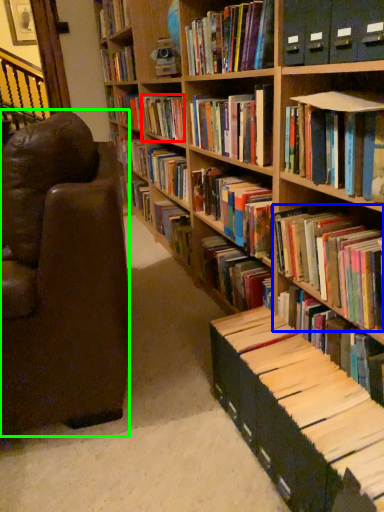
Question: Which object is positioned farthest from book (highlighted by a red box)? Select from book (highlighted by a blue box) and chair (highlighted by a green box).

Choices:
 (A) book
 (B) chair

Answer: (A)